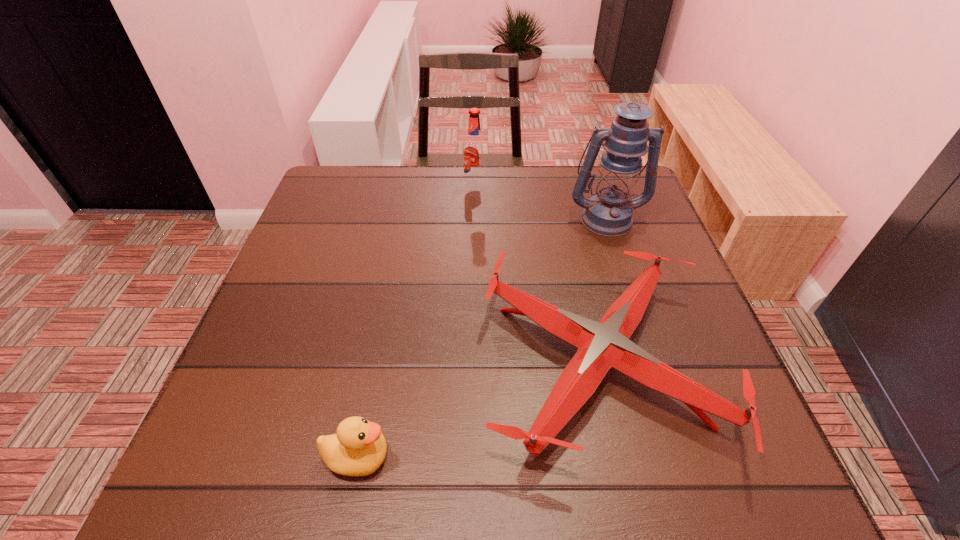
Where is `vacant space that is in between the duck and the drone`? Image resolution: width=960 pixels, height=540 pixels. vacant space that is in between the duck and the drone is located at coordinates (477, 410).

Where is `empty space that is in between the drone and the duck`? This screenshot has height=540, width=960. empty space that is in between the drone and the duck is located at coordinates pyautogui.click(x=477, y=410).

Find the location of a particular element. This screenshot has width=960, height=540. vacant region between the leftmost object and the farthest object is located at coordinates (416, 321).

At what (x,y) coordinates should I click in order to perform the action: click on free point between the duck and the second tallest object. Please return your answer as a coordinate pair (x, y). Looking at the image, I should click on (416, 321).

Identify the location of object that is the nearest to the duck. This screenshot has height=540, width=960. (602, 345).

Identify which object is the third closest to the drone. Please provide its 2D coordinates. Your answer should be formatted as a tuple, i.e. [(x, y)], where the tuple contains the x and y coordinates of a point satisfying the conditions above.

[(474, 152)]

This screenshot has width=960, height=540. I want to click on free location that satisfies the following two spatial constraints: 1. on the front-facing side of the lantern; 2. at the beak of the leftmost object, so click(x=684, y=457).

Image resolution: width=960 pixels, height=540 pixels. What are the coordinates of `free location that satisfies the following two spatial constraints: 1. on the front-facing side of the second farthest object; 2. at the beak of the duck` in the screenshot? It's located at (684, 457).

Find the location of a particular element. The height and width of the screenshot is (540, 960). vacant space that satisfies the following two spatial constraints: 1. on the front-facing side of the lantern; 2. at the beak of the duck is located at coordinates (684, 457).

Locate an element on the screen. vacant space that satisfies the following two spatial constraints: 1. on the front-facing side of the lantern; 2. at the beak of the duck is located at coordinates (684, 457).